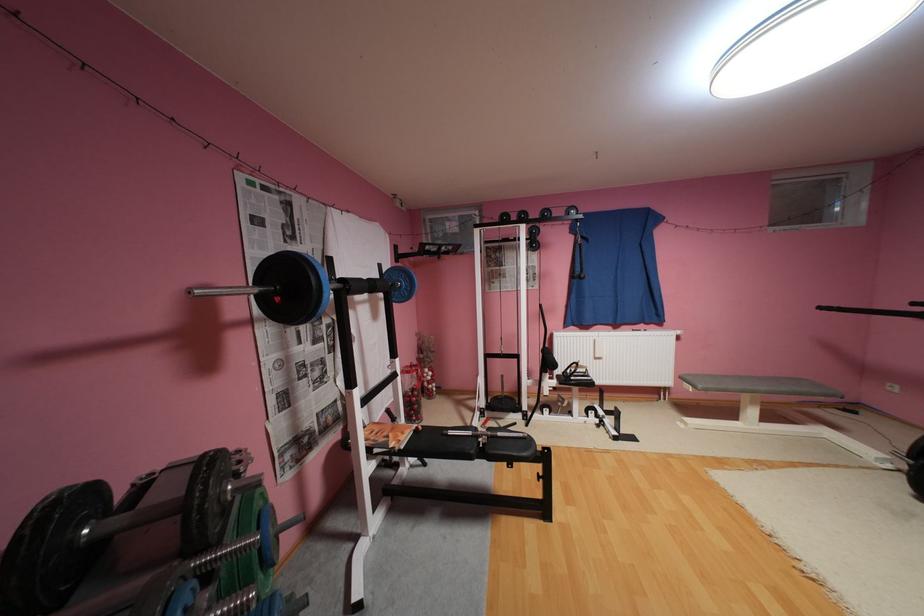
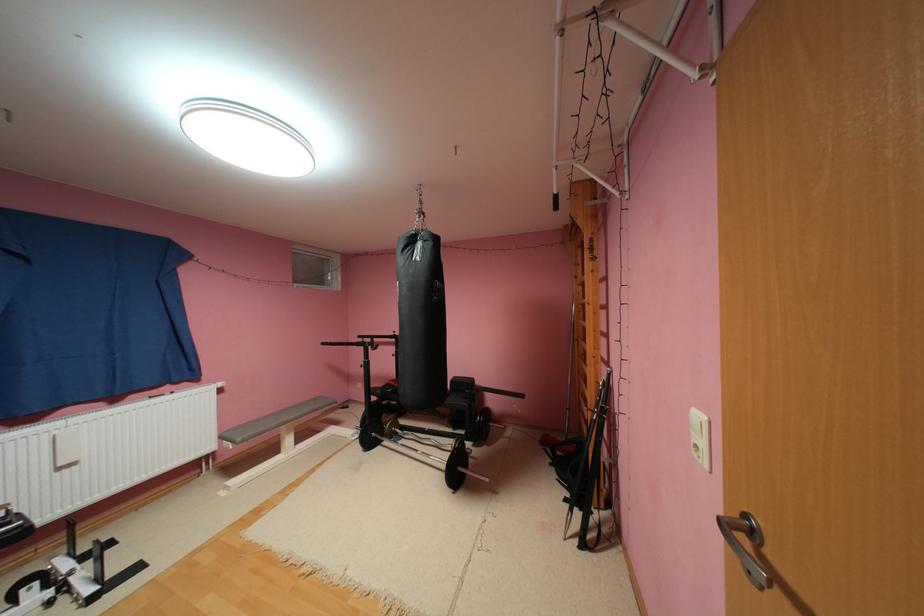
Where in the second image is the point corresponding to point (771, 387) from the first image?

(300, 416)